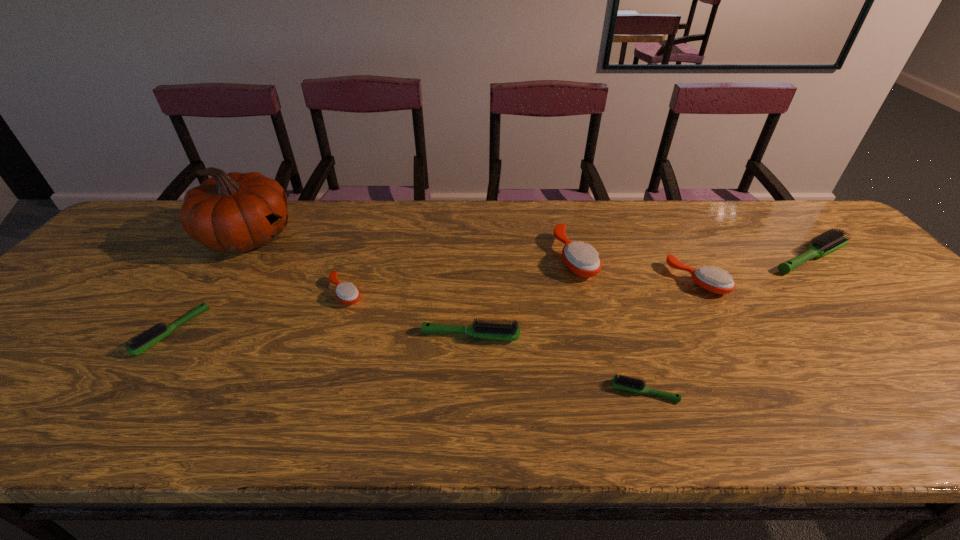
Find the location of `orange pumpkin`. orange pumpkin is located at coordinates (236, 212).

At what (x,y) coordinates should I click in order to perform the action: click on pumpkin. Please return your answer as a coordinate pair (x, y). Looking at the image, I should click on (236, 212).

At what (x,y) coordinates should I click in order to perform the action: click on the second orange hairbrush from right to left. Please return your answer as a coordinate pair (x, y). Image resolution: width=960 pixels, height=540 pixels. Looking at the image, I should click on (582, 259).

Where is `the seventh shortest object`? The width and height of the screenshot is (960, 540). the seventh shortest object is located at coordinates (582, 259).

At what (x,y) coordinates should I click in order to perform the action: click on the second hairbrush from right to left. Please return your answer as a coordinate pair (x, y). This screenshot has height=540, width=960. Looking at the image, I should click on (713, 280).

You are a GUI agent. You are given a task and a screenshot of the screen. Output one action in this format:
    pyautogui.click(x=<x>, y=<y>)
    Task: Click on the rightmost orange hairbrush
    
    Given the screenshot: What is the action you would take?
    pyautogui.click(x=713, y=280)

Identify the location of the rightmost object. (831, 240).

Find the location of a particular element. Image resolution: width=960 pixels, height=540 pixels. the biggest light hairbrush is located at coordinates (831, 240).

Where is `the fifth hairbrush from right to left`? The height and width of the screenshot is (540, 960). the fifth hairbrush from right to left is located at coordinates (510, 332).

Identify the location of the second biggest light hairbrush. (510, 332).